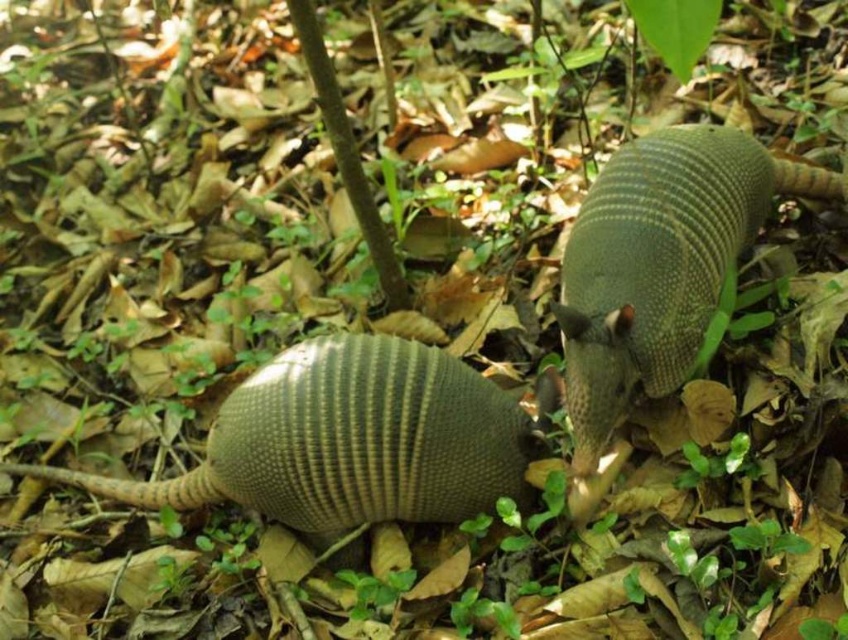
Question: Can you confirm if brown textured armadillo at lower left is smaller than green textured armadillo at center?

Choices:
 (A) yes
 (B) no

Answer: (A)

Question: Which of the following is the farthest from the observer?

Choices:
 (A) (95, 490)
 (B) (651, 273)

Answer: (A)

Question: Can you confirm if brown textured armadillo at lower left is smaller than green textured armadillo at center?

Choices:
 (A) yes
 (B) no

Answer: (A)

Question: Which object is closer to the camera taking this photo?

Choices:
 (A) brown textured armadillo at lower left
 (B) green textured armadillo at center

Answer: (B)

Question: Is brown textured armadillo at lower left wider than green textured armadillo at center?

Choices:
 (A) no
 (B) yes

Answer: (B)

Question: Which point is farther from the camera taking this photo?

Choices:
 (A) (762, 173)
 (B) (227, 467)

Answer: (A)